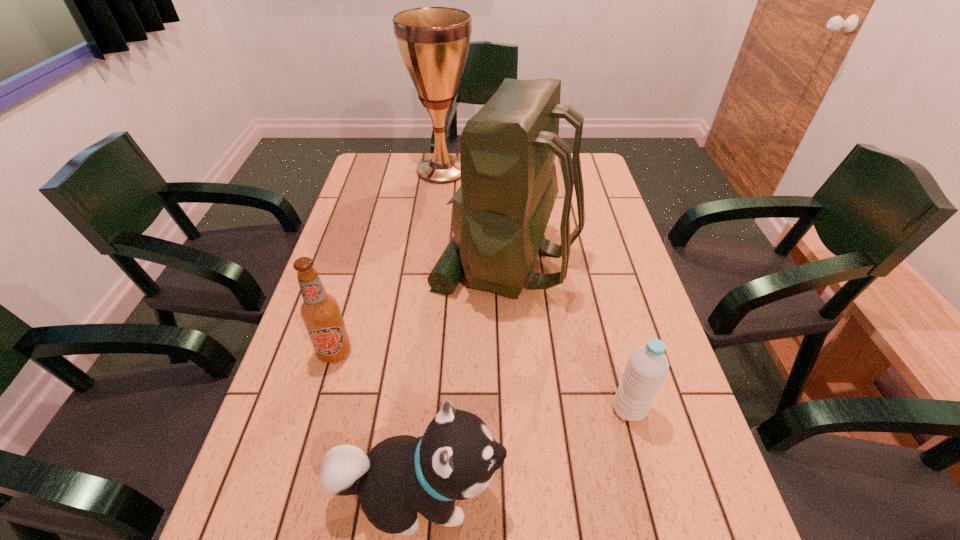
The width and height of the screenshot is (960, 540). In order to click on vacant area located on the left of the water bottle in this screenshot , I will do `click(575, 409)`.

Identify the location of object situated at the far edge. The image size is (960, 540). (434, 42).

You are a GUI agent. You are given a task and a screenshot of the screen. Output one action in this format:
    pyautogui.click(x=<x>, y=<y>)
    Task: Click on the object present at the left edge
    The width and height of the screenshot is (960, 540).
    Given the screenshot: What is the action you would take?
    pyautogui.click(x=320, y=312)

Identify the location of backpack situated at the right edge. (509, 185).

Image resolution: width=960 pixels, height=540 pixels. What are the coordinates of `water bottle at the right edge` in the screenshot? It's located at (647, 367).

The height and width of the screenshot is (540, 960). What are the coordinates of `vacant space at the far edge of the desktop` in the screenshot? It's located at (454, 183).

In the image, there is a desktop. Identify the location of vacant area at the left edge. The height and width of the screenshot is (540, 960). (393, 198).

In the image, there is a desktop. What are the coordinates of `blank space at the right edge` in the screenshot? It's located at (615, 230).

In the image, there is a desktop. Where is `free space at the far left corner`? This screenshot has height=540, width=960. free space at the far left corner is located at coordinates (394, 159).

Identify the location of free space between the fourth nearest object and the leftmost object. The width and height of the screenshot is (960, 540). (420, 307).